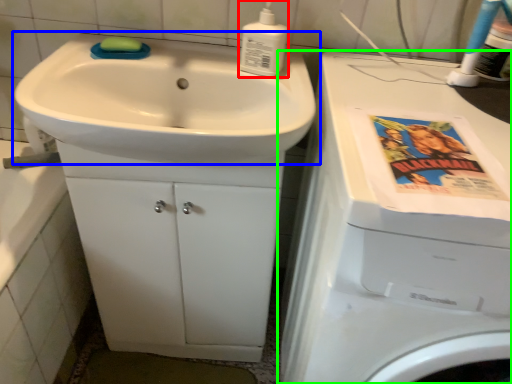
Question: Which object is the closest to the soap dispenser (highlighted by a red box)? Choose among these: sink (highlighted by a blue box) or washing machine (highlighted by a green box).

Choices:
 (A) sink
 (B) washing machine

Answer: (A)